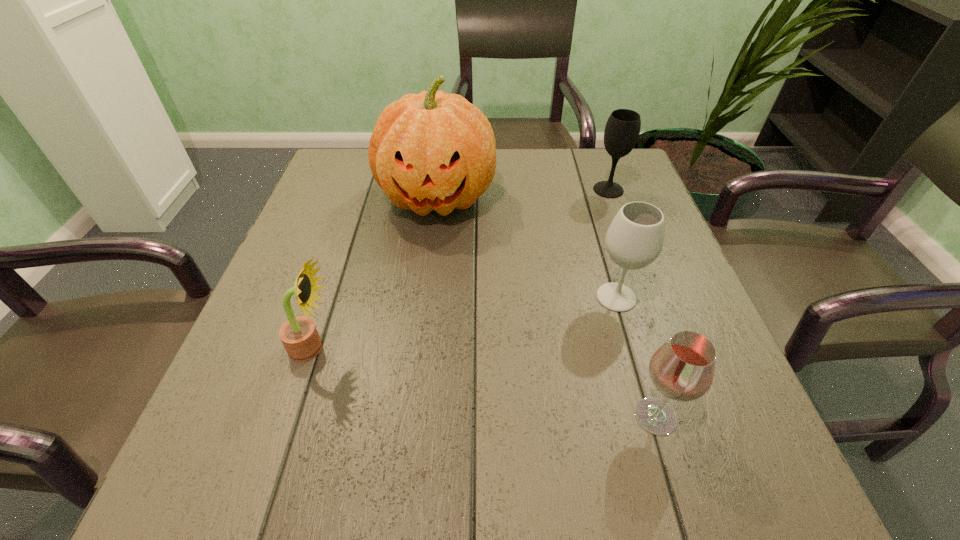
Find the location of a particular element. vacant space at the far right corner is located at coordinates (589, 174).

You are a GUI agent. You are given a task and a screenshot of the screen. Output one action in this format:
    pyautogui.click(x=<x>, y=<y>)
    Task: Click on the free spot between the sunflower and the nearest object
    
    Given the screenshot: What is the action you would take?
    pyautogui.click(x=484, y=382)

Identify the location of vacant space in between the tallest object and the nearest object. This screenshot has width=960, height=540. (546, 307).

I want to click on free space between the pumpkin and the fourth farthest object, so click(x=375, y=273).

Locate an element on the screen. The image size is (960, 540). unoccupied position between the second farthest wineglass and the fourth farthest object is located at coordinates (465, 323).

The height and width of the screenshot is (540, 960). What are the coordinates of `free spot between the pumpkin and the farthest wineglass` in the screenshot? It's located at (523, 194).

Where is `vacant area that lies between the third farthest object and the nearest wineglass`? vacant area that lies between the third farthest object and the nearest wineglass is located at coordinates (636, 357).

Locate an element on the screen. free space between the tallest object and the nearest object is located at coordinates (546, 307).

At what (x,y) coordinates should I click in order to perform the action: click on object that ranks as the third closest to the fourth farthest object. Please return your answer as a coordinate pair (x, y). This screenshot has height=540, width=960. Looking at the image, I should click on (682, 369).

Find the location of a particular element. The image size is (960, 540). object that stands as the third closest to the farthest wineglass is located at coordinates (682, 369).